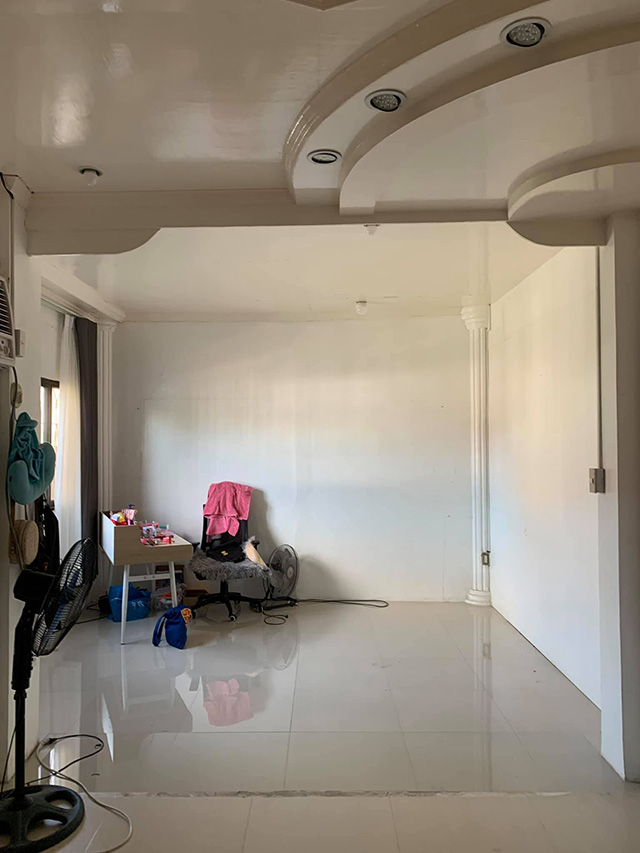
Locate an element on the screen. recessed lights is located at coordinates (322, 158), (390, 99), (518, 42).